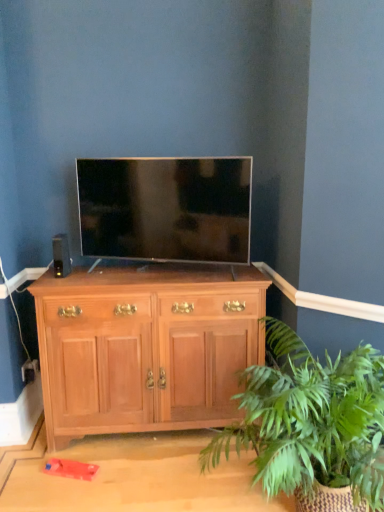
The image size is (384, 512). Find the location of `free spot in front of black matte speaker at left`. free spot in front of black matte speaker at left is located at coordinates (57, 279).